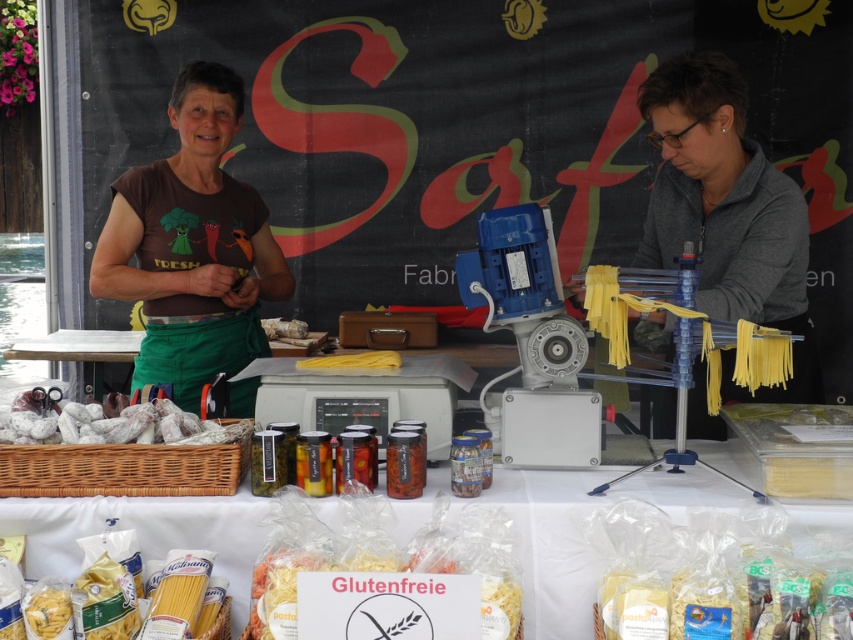
Is gluten-free pasta at center positioned before white paper wrapped at lower left?

Yes.

Locate an element on the screen. gluten-free pasta at center is located at coordinates (398, 604).

Is point (463, 627) less distant than point (173, 442)?

That is True.

Where is `gluten-free pasta at center`? gluten-free pasta at center is located at coordinates (398, 604).

Does white matte pasta at lower left appear on the left side of translucent plastic pasta at lower center?

Correct, you'll find white matte pasta at lower left to the left of translucent plastic pasta at lower center.

Where is `white matte pasta at lower left`? white matte pasta at lower left is located at coordinates (82, 608).

Who is more distant from viewer, (96, 589) or (790, 634)?

The point (96, 589) is more distant.

Locate an element on the screen. The image size is (853, 640). white matte pasta at lower left is located at coordinates (82, 608).

Is brown fabric shirt at center taller than yellow matte pasta at center?

Yes.

Who is taller, brown fabric shirt at center or yellow matte pasta at center?

brown fabric shirt at center

Who is more forward, [115,248] or [317,368]?

Positioned in front is point [317,368].

This screenshot has height=640, width=853. I want to click on brown fabric shirt at center, so tap(192, 244).